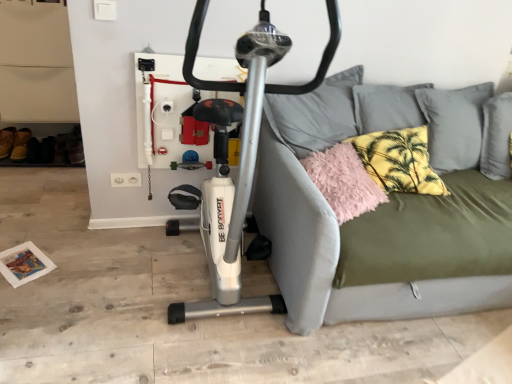
What do you see at coordinates (380, 212) in the screenshot? I see `olive green fabric studio couch at center` at bounding box center [380, 212].

Describe the element at coordinates (399, 161) in the screenshot. I see `yellow palm-patterned pillow at upper right, the 1th pillow viewed from the right` at that location.

The image size is (512, 384). Identify the location of fluffy pink pillow at right, the second pillow viewed from the right. (344, 181).

What is the approximate height of fluffy pink pillow at right, which is counted as the first pillow, starting from the left?

8.66 inches.

You are a GUI agent. You are given a task and a screenshot of the screen. Output one action in this format:
    pyautogui.click(x=<x>, y=<y>)
    Task: Click on the silver metallic stationary bicycle at center
    
    Given the screenshot: What is the action you would take?
    pyautogui.click(x=244, y=145)

Identify the location of brown suede shoe at lower left. (7, 141).

Where is `olive green fabric studio couch at center`? olive green fabric studio couch at center is located at coordinates (380, 212).

Who is more distant, fluffy pink pillow at right, which is counted as the first pillow, starting from the left, or silver metallic stationary bicycle at center?

fluffy pink pillow at right, which is counted as the first pillow, starting from the left.

Would you say fluffy pink pillow at right, which is counted as the first pillow, starting from the left, is outside silver metallic stationary bicycle at center?

Yes, fluffy pink pillow at right, which is counted as the first pillow, starting from the left, is located beyond the bounds of silver metallic stationary bicycle at center.

Between fluffy pink pillow at right, the second pillow viewed from the right, and silver metallic stationary bicycle at center, which one has smaller size?

fluffy pink pillow at right, the second pillow viewed from the right, is smaller.

From the image's perspective, is fluffy pink pillow at right, which is counted as the first pillow, starting from the left, on silver metallic stationary bicycle at center?

Actually, fluffy pink pillow at right, which is counted as the first pillow, starting from the left, appears below silver metallic stationary bicycle at center in the image.

From the image's perspective, is silver metallic stationary bicycle at center under yellow palm-patterned pillow at upper right, the 1th pillow viewed from the right?

Correct, silver metallic stationary bicycle at center appears lower than yellow palm-patterned pillow at upper right, the 1th pillow viewed from the right, in the image.

Does silver metallic stationary bicycle at center have a lesser height compared to yellow palm-patterned pillow at upper right, the 1th pillow viewed from the right?

No.

From a real-world perspective, is silver metallic stationary bicycle at center located beneath yellow palm-patterned pillow at upper right, the 2th pillow in the left-to-right sequence?

No, from a real-world perspective, silver metallic stationary bicycle at center is not below yellow palm-patterned pillow at upper right, the 2th pillow in the left-to-right sequence.

Considering the sizes of silver metallic stationary bicycle at center and yellow palm-patterned pillow at upper right, the 2th pillow in the left-to-right sequence, in the image, is silver metallic stationary bicycle at center wider or thinner than yellow palm-patterned pillow at upper right, the 2th pillow in the left-to-right sequence,?

silver metallic stationary bicycle at center is wider than yellow palm-patterned pillow at upper right, the 2th pillow in the left-to-right sequence.

Is point (394, 157) farther from viewer compared to point (394, 317)?

Yes, point (394, 157) is farther from viewer.

Could you tell me if yellow palm-patterned pillow at upper right, the 1th pillow viewed from the right, is turned towards olive green fabric studio couch at center?

Yes, yellow palm-patterned pillow at upper right, the 1th pillow viewed from the right, is aimed at olive green fabric studio couch at center.

Between yellow palm-patterned pillow at upper right, the 1th pillow viewed from the right, and olive green fabric studio couch at center, which one has larger width?

With larger width is olive green fabric studio couch at center.

Looking at this image, is there a large distance between yellow palm-patterned pillow at upper right, the 2th pillow in the left-to-right sequence, and olive green fabric studio couch at center?

No.

Which is behind, brown suede shoe at lower left or olive green fabric studio couch at center?

brown suede shoe at lower left is more distant.

Would you say brown suede shoe at lower left is inside or outside olive green fabric studio couch at center?

brown suede shoe at lower left exists outside the volume of olive green fabric studio couch at center.

Does brown suede shoe at lower left have a greater height compared to olive green fabric studio couch at center?

Incorrect, the height of brown suede shoe at lower left is not larger of that of olive green fabric studio couch at center.

Is brown suede shoe at lower left directly adjacent to olive green fabric studio couch at center?

They are not placed beside each other.

Are brown suede shoe at lower left and silver metallic stationary bicycle at center making contact?

No, brown suede shoe at lower left is not beside silver metallic stationary bicycle at center.

Is brown suede shoe at lower left bigger than silver metallic stationary bicycle at center?

No.

Does brown suede shoe at lower left turn towards silver metallic stationary bicycle at center?

No, brown suede shoe at lower left is not oriented towards silver metallic stationary bicycle at center.

Between point (9, 155) and point (234, 278), which one is positioned in front?

The point (234, 278) is more forward.

Could you tell me if silver metallic stationary bicycle at center is facing olive green fabric studio couch at center?

No, silver metallic stationary bicycle at center is not facing towards olive green fabric studio couch at center.

Can olive green fabric studio couch at center be found inside silver metallic stationary bicycle at center?

That's incorrect, olive green fabric studio couch at center is not inside silver metallic stationary bicycle at center.

Considering the positions of point (249, 312) and point (305, 126), is point (249, 312) closer or farther from the camera than point (305, 126)?

Point (249, 312) is positioned closer to the camera compared to point (305, 126).

From a real-world perspective, is olive green fabric studio couch at center below silver metallic stationary bicycle at center?

Correct, in the physical world, olive green fabric studio couch at center is lower than silver metallic stationary bicycle at center.

Considering the positions of objects olive green fabric studio couch at center and silver metallic stationary bicycle at center in the image provided, who is more to the left, olive green fabric studio couch at center or silver metallic stationary bicycle at center?

Positioned to the left is silver metallic stationary bicycle at center.

Considering the relative sizes of olive green fabric studio couch at center and silver metallic stationary bicycle at center in the image provided, is olive green fabric studio couch at center wider than silver metallic stationary bicycle at center?

Yes.

Which object is closer to the camera taking this photo, olive green fabric studio couch at center or silver metallic stationary bicycle at center?

silver metallic stationary bicycle at center is more forward.

Identify the location of stationary bicycle in front of the fluffy pink pillow at right, the second pillow viewed from the right. The image size is (512, 384). (244, 145).

The height and width of the screenshot is (384, 512). What are the coordinates of `pillow that is the 2nd one when counting rightward from the silver metallic stationary bicycle at center` in the screenshot? It's located at (399, 161).

From the image, which object appears to be nearer to olive green fabric studio couch at center, fluffy pink pillow at right, which is counted as the first pillow, starting from the left, or brown suede shoe at lower left?

fluffy pink pillow at right, which is counted as the first pillow, starting from the left, is positioned closer to the anchor olive green fabric studio couch at center.

Based on their spatial positions, is brown suede shoe at lower left or yellow palm-patterned pillow at upper right, the 2th pillow in the left-to-right sequence, further from silver metallic stationary bicycle at center?

brown suede shoe at lower left lies further to silver metallic stationary bicycle at center than the other object.

When comparing their distances from yellow palm-patterned pillow at upper right, the 2th pillow in the left-to-right sequence, does olive green fabric studio couch at center or brown suede shoe at lower left seem closer?

Based on the image, olive green fabric studio couch at center appears to be nearer to yellow palm-patterned pillow at upper right, the 2th pillow in the left-to-right sequence.

Considering their positions, is fluffy pink pillow at right, the second pillow viewed from the right, positioned further to silver metallic stationary bicycle at center than yellow palm-patterned pillow at upper right, the 2th pillow in the left-to-right sequence?

yellow palm-patterned pillow at upper right, the 2th pillow in the left-to-right sequence, lies further to silver metallic stationary bicycle at center than the other object.

When comparing their distances from brown suede shoe at lower left, does olive green fabric studio couch at center or fluffy pink pillow at right, the second pillow viewed from the right, seem further?

Based on the image, olive green fabric studio couch at center appears to be further to brown suede shoe at lower left.

Which object lies nearer to the anchor point olive green fabric studio couch at center, silver metallic stationary bicycle at center or brown suede shoe at lower left?

silver metallic stationary bicycle at center.

Considering their positions, is brown suede shoe at lower left positioned further to olive green fabric studio couch at center than fluffy pink pillow at right, which is counted as the first pillow, starting from the left?

Based on the image, brown suede shoe at lower left appears to be further to olive green fabric studio couch at center.

Estimate the real-world distances between objects in this image. Which object is closer to olive green fabric studio couch at center, yellow palm-patterned pillow at upper right, the 1th pillow viewed from the right, or fluffy pink pillow at right, the second pillow viewed from the right?

fluffy pink pillow at right, the second pillow viewed from the right.

Find the location of a particular element. This screenshot has height=384, width=512. pillow situated between brown suede shoe at lower left and yellow palm-patterned pillow at upper right, the 2th pillow in the left-to-right sequence, from left to right is located at coordinates (344, 181).

The height and width of the screenshot is (384, 512). I want to click on stationary bicycle between brown suede shoe at lower left and olive green fabric studio couch at center, so click(244, 145).

Image resolution: width=512 pixels, height=384 pixels. I want to click on pillow between silver metallic stationary bicycle at center and yellow palm-patterned pillow at upper right, the 2th pillow in the left-to-right sequence, from front to back, so click(x=344, y=181).

Identify the location of stationary bicycle between brown suede shoe at lower left and yellow palm-patterned pillow at upper right, the 2th pillow in the left-to-right sequence, from left to right. The height and width of the screenshot is (384, 512). (244, 145).